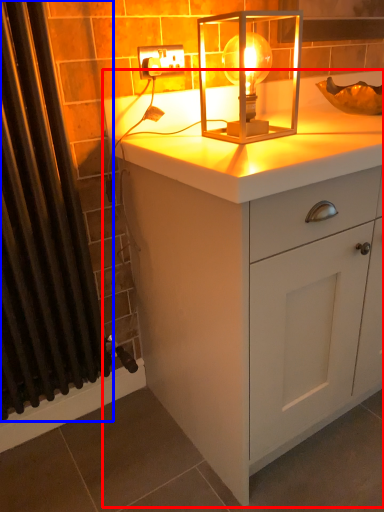
Question: Which of the following is the farthest to the observer, chest of drawers (highlighted by a red box) or shower curtain (highlighted by a blue box)?

Choices:
 (A) chest of drawers
 (B) shower curtain

Answer: (A)